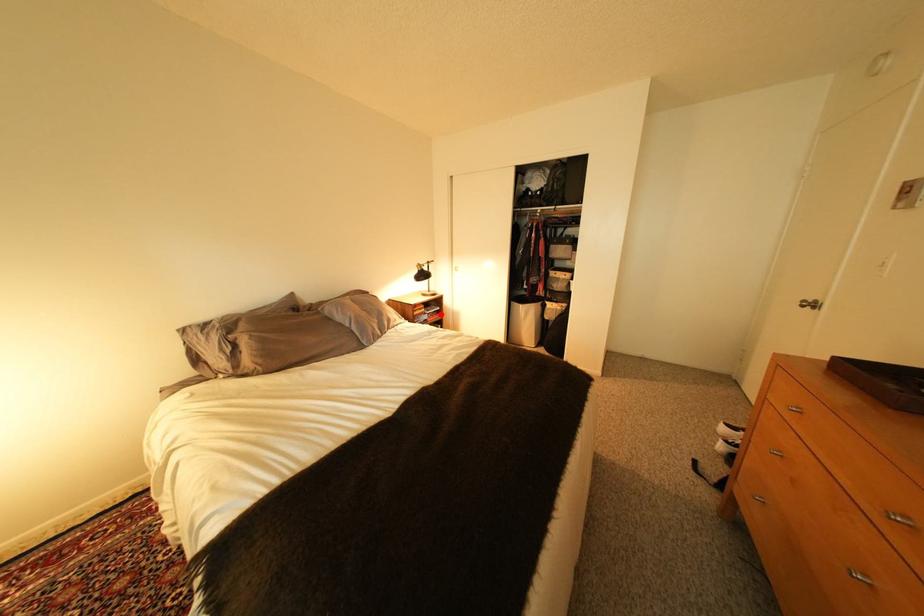
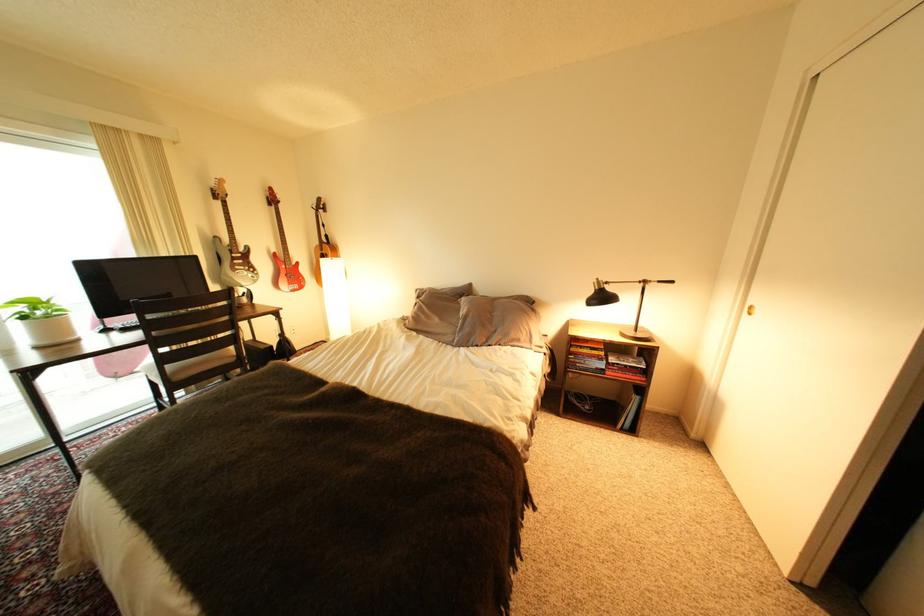
Locate, in the second image, the point that corresponds to the highlighted location in the first image.

(623, 363)